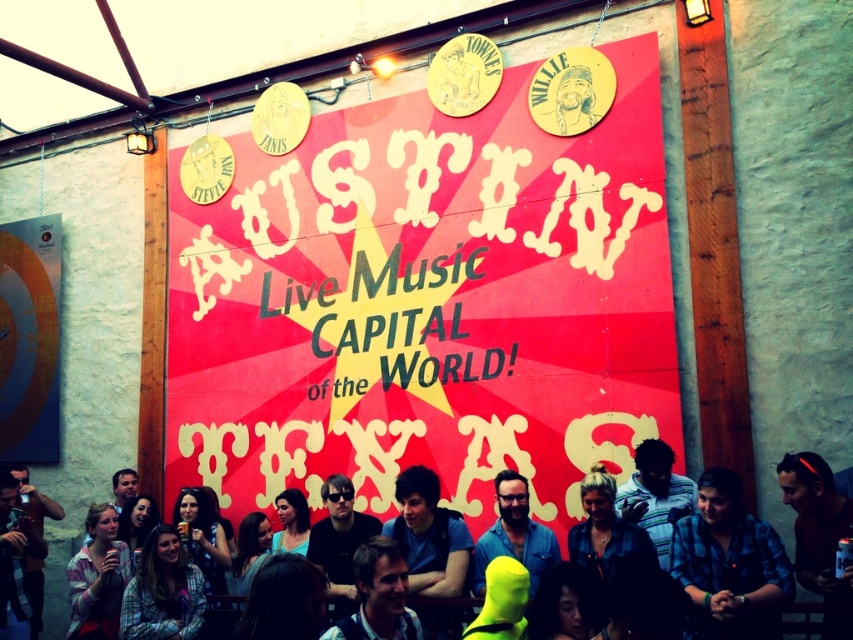
Question: Is red matte poster at center bigger than smooth skin face at center?

Choices:
 (A) yes
 (B) no

Answer: (B)

Question: Which object appears farthest from the camera in this image?

Choices:
 (A) dark blue shirt at lower right
 (B) blue plaid shirt at lower right
 (C) blue denim shirt at center
 (D) light brown hair at center

Answer: (D)

Question: Is neon yellow wig at lower center below matte black camera at lower left?

Choices:
 (A) yes
 (B) no

Answer: (B)

Question: Which object is closer to the camera taking this photo?

Choices:
 (A) dark blue shirt at lower right
 (B) red matte poster at center
 (C) blue plaid shirt at lower right
 (D) matte black shirt at center

Answer: (C)

Question: Observing the image, what is the correct spatial positioning of matte black camera at lower left in reference to light brown hair at center?

Choices:
 (A) left
 (B) right

Answer: (A)

Question: Among these objects, which one is farthest from the camera?

Choices:
 (A) matte pink shirt at lower left
 (B) dark blue shirt at lower right
 (C) smooth skin face at center

Answer: (A)